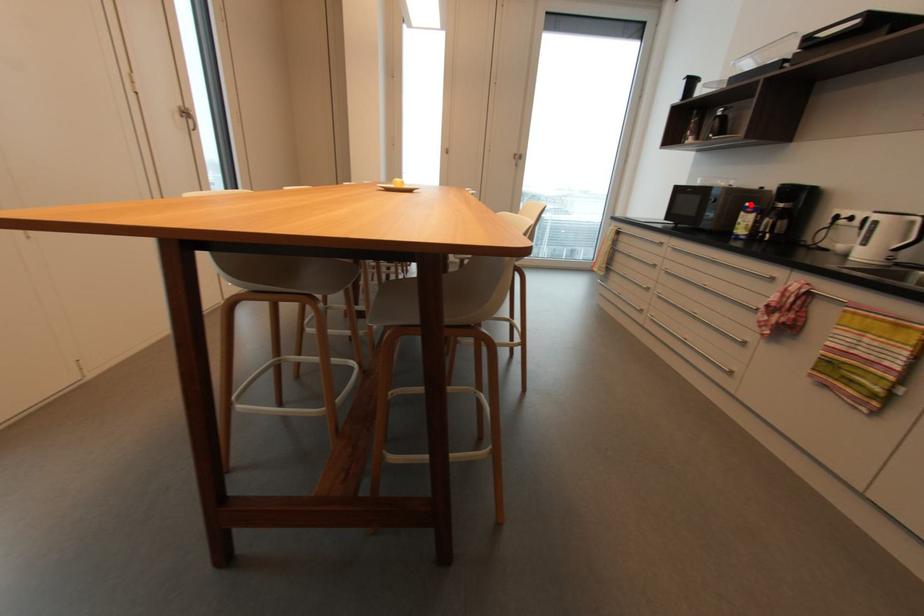
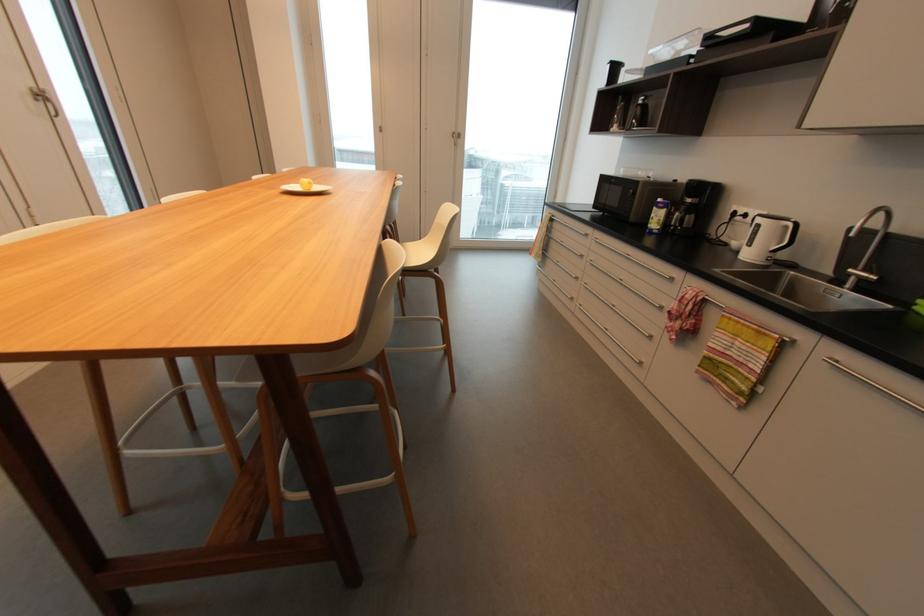
In the second image, find the point that corresponds to the highlighted location in the first image.

(663, 200)